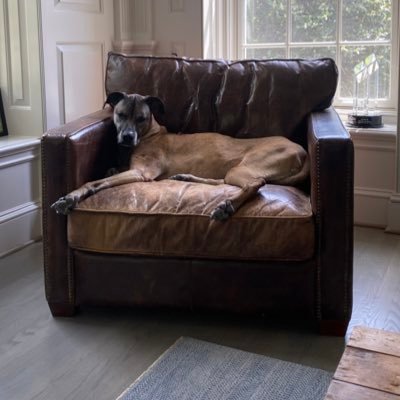
The height and width of the screenshot is (400, 400). What are the coordinates of `floor` in the screenshot? It's located at (125, 348).